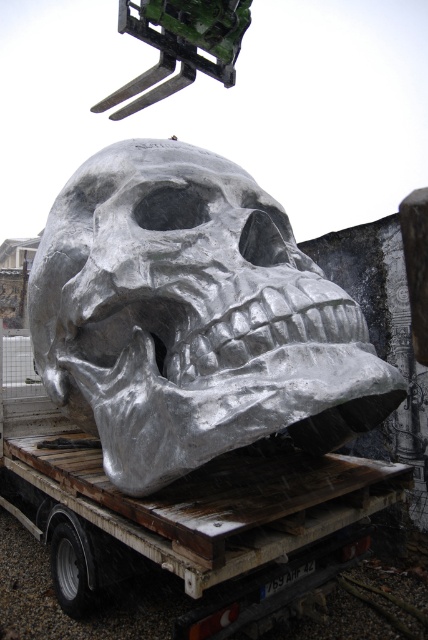
Is shiny metallic skull at center bigger than metallic silver trailer truck at center?

Actually, shiny metallic skull at center might be smaller than metallic silver trailer truck at center.

Which is above, shiny metallic skull at center or metallic silver trailer truck at center?

shiny metallic skull at center

Does point (142, 472) lie behind point (211, 589)?

No, (142, 472) is in front of (211, 589).

What are the coordinates of `shiny metallic skull at center` in the screenshot? It's located at (193, 317).